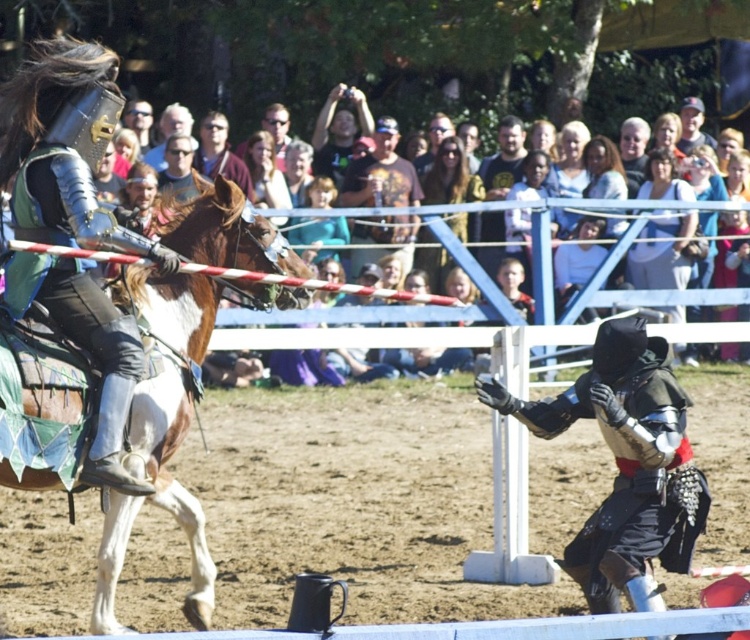
Question: Does brown glossy horse at left appear on the right side of brown leather jacket at center?

Choices:
 (A) yes
 (B) no

Answer: (B)

Question: Among these points, which one is nearest to the camera?

Choices:
 (A) (598, 520)
 (B) (352, 225)
 (C) (112, 292)

Answer: (C)

Question: Observing the image, what is the correct spatial positioning of shiny black armor at center in reference to brown leather jacket at center?

Choices:
 (A) left
 (B) right

Answer: (B)

Question: Which point is closer to the camera?

Choices:
 (A) shiny black armor at center
 (B) brown leather jacket at center
 (C) brown glossy horse at left

Answer: (C)

Question: Which object appears closest to the camera in this image?

Choices:
 (A) brown glossy horse at left
 (B) brown leather jacket at center
 (C) shiny black armor at center

Answer: (A)

Question: Does brown glossy horse at left lie in front of brown leather jacket at center?

Choices:
 (A) yes
 (B) no

Answer: (A)